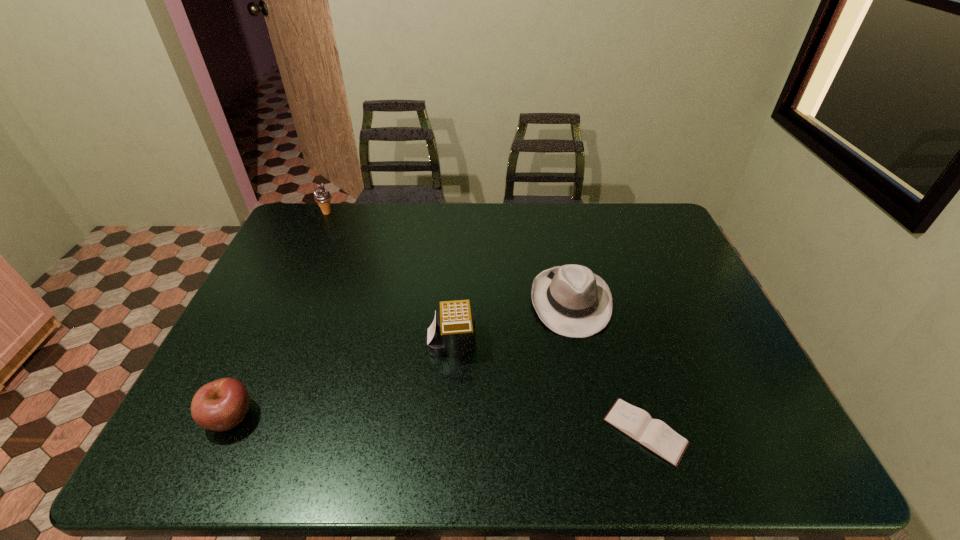
Identify the location of icecream. (322, 196).

Where is `the third object from left to right`? Image resolution: width=960 pixels, height=540 pixels. the third object from left to right is located at coordinates (452, 333).

You are a GUI agent. You are given a task and a screenshot of the screen. Output one action in this format:
    pyautogui.click(x=<x>, y=<y>)
    Task: Click on the fedora
    
    Given the screenshot: What is the action you would take?
    pyautogui.click(x=571, y=300)

Image resolution: width=960 pixels, height=540 pixels. In order to click on apple in this screenshot , I will do `click(220, 405)`.

Identify the location of diary. The width and height of the screenshot is (960, 540). (655, 435).

Image resolution: width=960 pixels, height=540 pixels. Identify the location of free space located on the right of the icecream. (445, 213).

The height and width of the screenshot is (540, 960). In order to click on free location located on the front of the third object from left to right in this screenshot , I will do `click(444, 459)`.

In order to click on blank area located 0.180m on the front-facing side of the fedora in this screenshot , I will do `click(591, 397)`.

The width and height of the screenshot is (960, 540). I want to click on free location located 0.060m on the side of the apple with the unique marking, so click(x=282, y=417).

This screenshot has height=540, width=960. I want to click on vacant space positioned on the left of the diary, so click(505, 431).